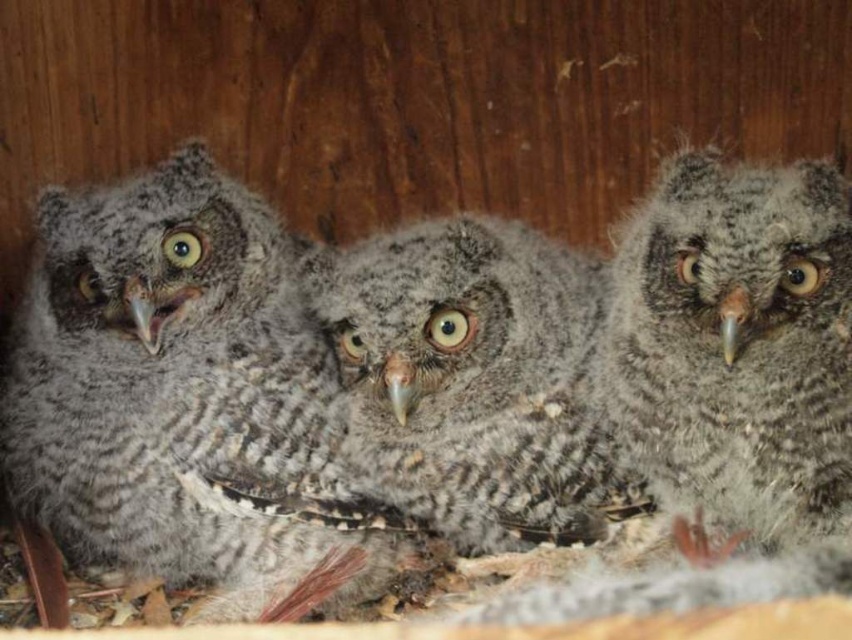
Question: Is gray fluffy owl at left bigger than gray fluffy owl at center?

Choices:
 (A) no
 (B) yes

Answer: (B)

Question: Which point appears farthest from the camera in this image?

Choices:
 (A) (102, 218)
 (B) (436, 312)
 (C) (609, 406)

Answer: (A)

Question: Can you confirm if gray fluffy owl at left is wider than gray fluffy owl at center?

Choices:
 (A) yes
 (B) no

Answer: (A)

Question: Which of these objects is positioned farthest from the gray fluffy owl at left?

Choices:
 (A) gray fluffy owl at right
 (B) gray fluffy owl at center

Answer: (A)

Question: Based on their relative distances, which object is farther from the gray fluffy owl at right?

Choices:
 (A) gray fluffy owl at left
 (B) gray fluffy owl at center

Answer: (A)

Question: From the image, what is the correct spatial relationship of gray fluffy owl at right in relation to gray fluffy owl at center?

Choices:
 (A) above
 (B) below

Answer: (A)